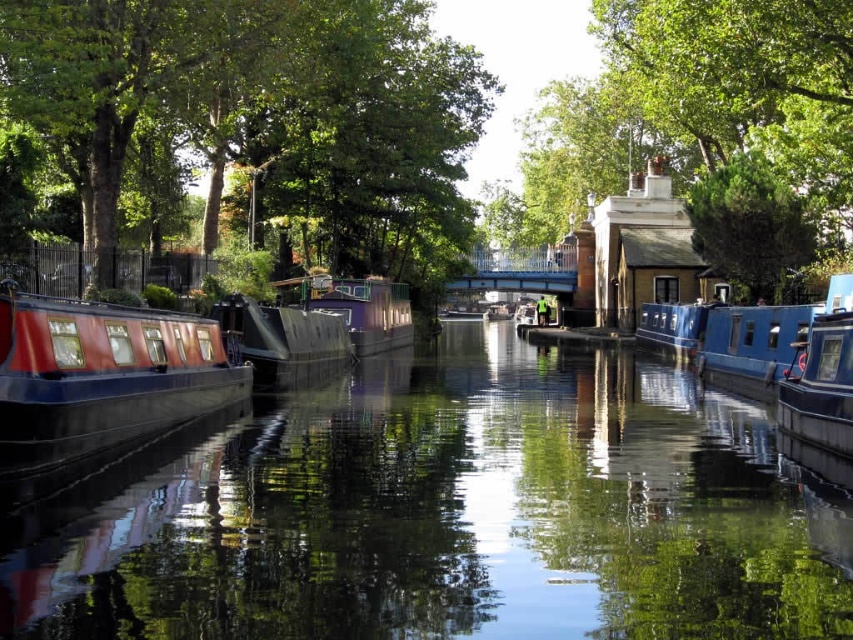
Is green leafy tree at center closer to the viewer compared to matte red barge at left?

No, green leafy tree at center is further to the viewer.

The image size is (853, 640). What do you see at coordinates (693, 106) in the screenshot?
I see `green leafy tree at center` at bounding box center [693, 106].

Where is `green leafy tree at center`? The image size is (853, 640). green leafy tree at center is located at coordinates (693, 106).

Is green leafy tree at upper right closer to camera compared to matte black barge at center?

No, green leafy tree at upper right is further to the viewer.

Between green leafy tree at upper right and matte black barge at center, which one has more height?

With more height is green leafy tree at upper right.

Where is `green leafy tree at upper right`? green leafy tree at upper right is located at coordinates (752, 228).

Does smooth water at center appear on the right side of matte black barge at center?

Yes, smooth water at center is to the right of matte black barge at center.

Is point (505, 433) closer to camera compared to point (299, 336)?

Yes, point (505, 433) is in front of point (299, 336).

You are a GUI agent. You are given a task and a screenshot of the screen. Output one action in this format:
    pyautogui.click(x=<x>, y=<y>)
    Task: Click on the smooth water at center
    This screenshot has width=853, height=640.
    Given the screenshot: What is the action you would take?
    [450, 515]

Image resolution: width=853 pixels, height=640 pixels. I want to click on smooth water at center, so tap(450, 515).